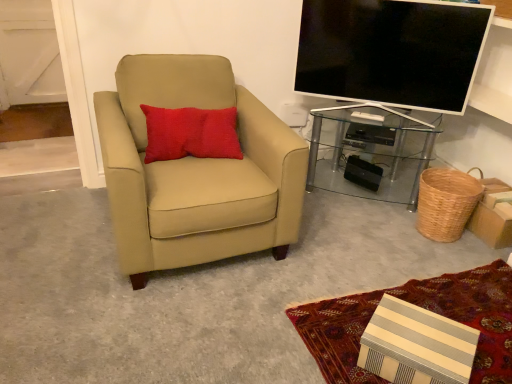
Identify the location of free location in front of woven brown basket at lower right. This screenshot has height=384, width=512. (445, 253).